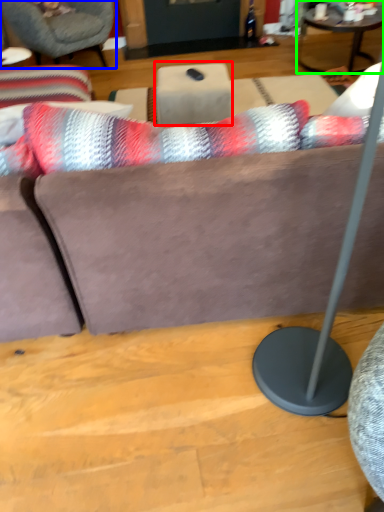
Question: Estimate the real-world distances between objects in this image. Which object is closer to table (highlighted by a red box), chair (highlighted by a blue box) or coffee table (highlighted by a green box)?

Choices:
 (A) chair
 (B) coffee table

Answer: (A)